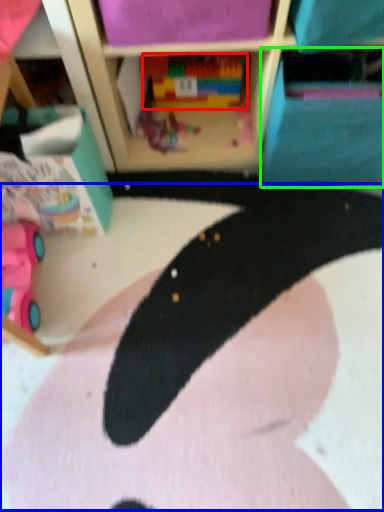
Question: Which object is positioned farthest from toy (highlighted by a red box)? Select from animal (highlighted by a blue box) and cabinet (highlighted by a green box).

Choices:
 (A) animal
 (B) cabinet

Answer: (A)